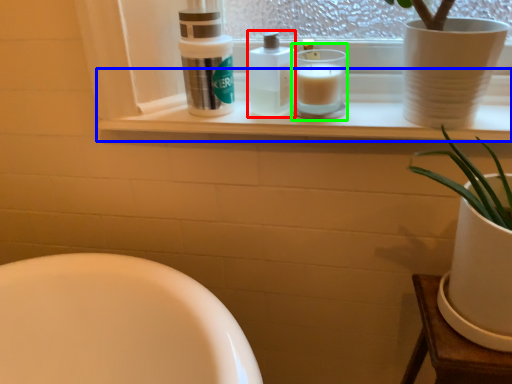
Question: Which object is positioned closest to toiletry (highlighted by a red box)? Select from window sill (highlighted by a blue box) and candle holder (highlighted by a green box).

Choices:
 (A) window sill
 (B) candle holder

Answer: (B)